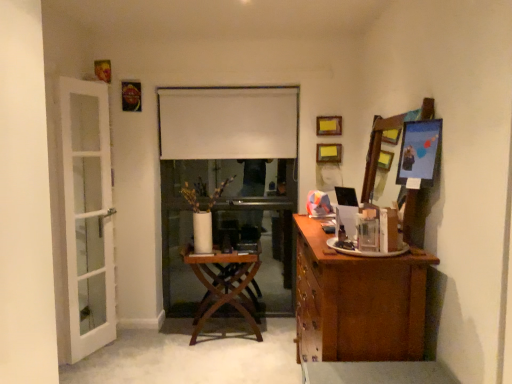
Question: From the image's perspective, is metallic silver picture frame at upper right, the 5th picture frame from the top, located beneath white matte curtain at center?

Choices:
 (A) no
 (B) yes

Answer: (B)

Question: Does metallic silver picture frame at upper right, which appears as the 1th picture frame when ordered from the bottom, lie in front of white matte curtain at center?

Choices:
 (A) no
 (B) yes

Answer: (B)

Question: Are metallic silver picture frame at upper right, which ranks as the 5th picture frame in left-to-right order, and white matte curtain at center making contact?

Choices:
 (A) no
 (B) yes

Answer: (A)

Question: Would you say white matte curtain at center is part of metallic silver picture frame at upper right, the 5th picture frame from the top,'s contents?

Choices:
 (A) yes
 (B) no

Answer: (B)

Question: Does metallic silver picture frame at upper right, which ranks as the 5th picture frame in left-to-right order, have a larger size compared to white matte curtain at center?

Choices:
 (A) no
 (B) yes

Answer: (A)

Question: Considering the relative sizes of metallic silver picture frame at upper right, which appears as the 1th picture frame when ordered from the bottom, and white matte curtain at center in the image provided, is metallic silver picture frame at upper right, which appears as the 1th picture frame when ordered from the bottom, wider than white matte curtain at center?

Choices:
 (A) yes
 (B) no

Answer: (A)

Question: Is white glass door at left at the back of wooden picture frame at upper center, acting as the 3th picture frame starting from the top?

Choices:
 (A) yes
 (B) no

Answer: (B)

Question: Can you confirm if wooden picture frame at upper center, the 2th picture frame positioned from the back, is taller than white glass door at left?

Choices:
 (A) no
 (B) yes

Answer: (A)

Question: Is the surface of wooden picture frame at upper center, the third picture frame positioned from the right, in direct contact with white glass door at left?

Choices:
 (A) yes
 (B) no

Answer: (B)

Question: Is wooden picture frame at upper center, the 3th picture frame when ordered from left to right, outside white glass door at left?

Choices:
 (A) yes
 (B) no

Answer: (A)

Question: From a real-world perspective, is wooden picture frame at upper center, the third picture frame positioned from the right, located beneath white glass door at left?

Choices:
 (A) yes
 (B) no

Answer: (B)

Question: Is wooden picture frame at upper center, the 4th picture frame from the front, in front of white glass door at left?

Choices:
 (A) yes
 (B) no

Answer: (B)

Question: Can you confirm if metallic silver picture frame at upper right, acting as the first picture frame starting from the front, is wider than metallic gold picture frame at upper left, the fourth picture frame in the back-to-front sequence?

Choices:
 (A) no
 (B) yes

Answer: (B)